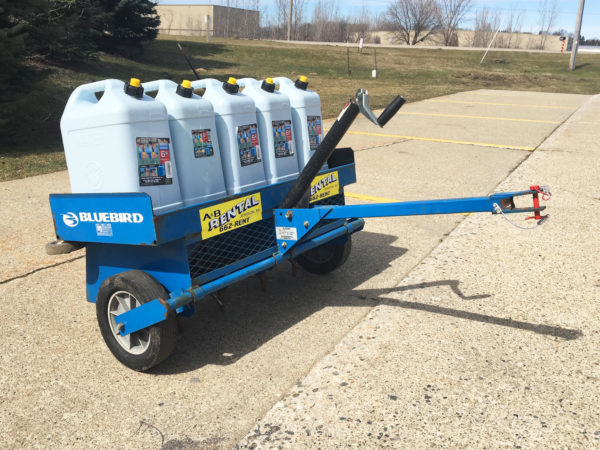
Locate an element on the screen. This screenshot has width=600, height=450. white canisters is located at coordinates (111, 146).